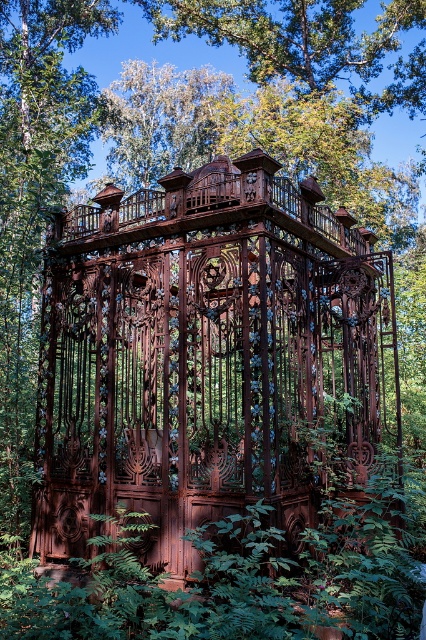
The height and width of the screenshot is (640, 426). I want to click on rusty metal gazebo at center, so point(210,358).

Is rusty metal gazebo at center in front of green leafy foliage at center?

No, it is not.

This screenshot has width=426, height=640. I want to click on rusty metal gazebo at center, so click(x=210, y=358).